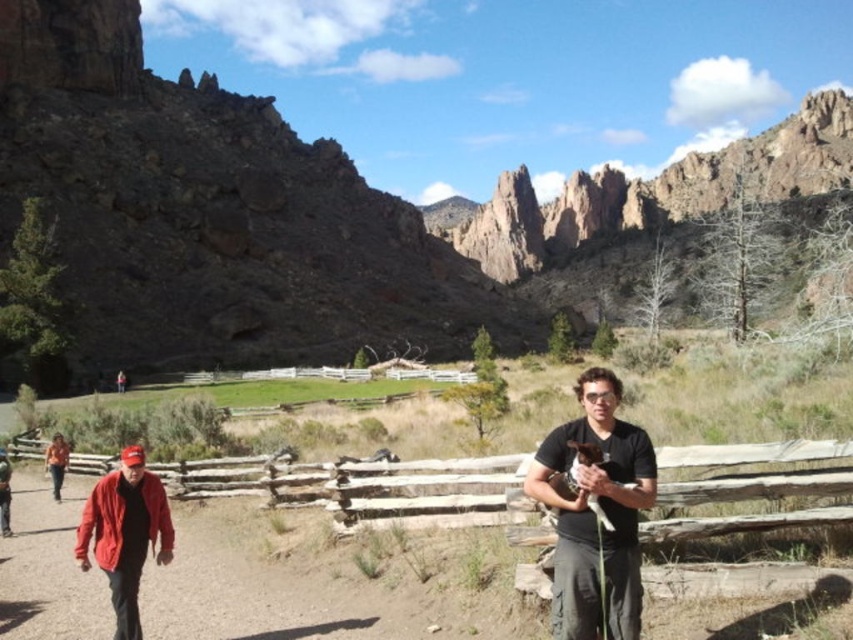
You are planning to take a photo of the wooden at center and the matte red jacket at left in the scene. Which object should you focus on first if you want to capture both in a single frame without moving the camera?

The wooden at center is larger in size than the matte red jacket at left, so you should focus on the wooden at center first to ensure it is clearly captured before adjusting for the smaller matte red jacket at left.

You are a hiker planning to take a photo of the rugged rock formation at upper center and the matte red jacket at left. Based on their positions, which object should you focus on first to ensure both are in the frame?

The rugged rock formation at upper center is positioned over the matte red jacket at left, so you should focus on the rugged rock formation at upper center first to ensure both are in the frame.